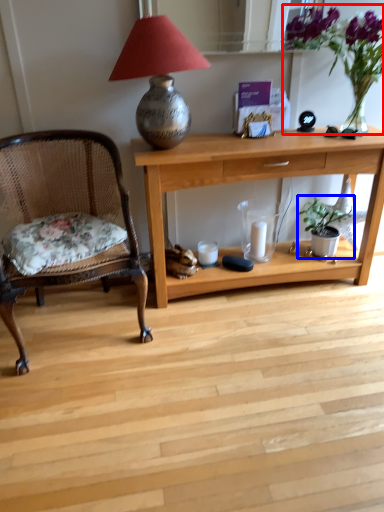
Question: Which point is further to the camera, floral arrangement (highlighted by a red box) or houseplant (highlighted by a blue box)?

Choices:
 (A) floral arrangement
 (B) houseplant

Answer: (B)